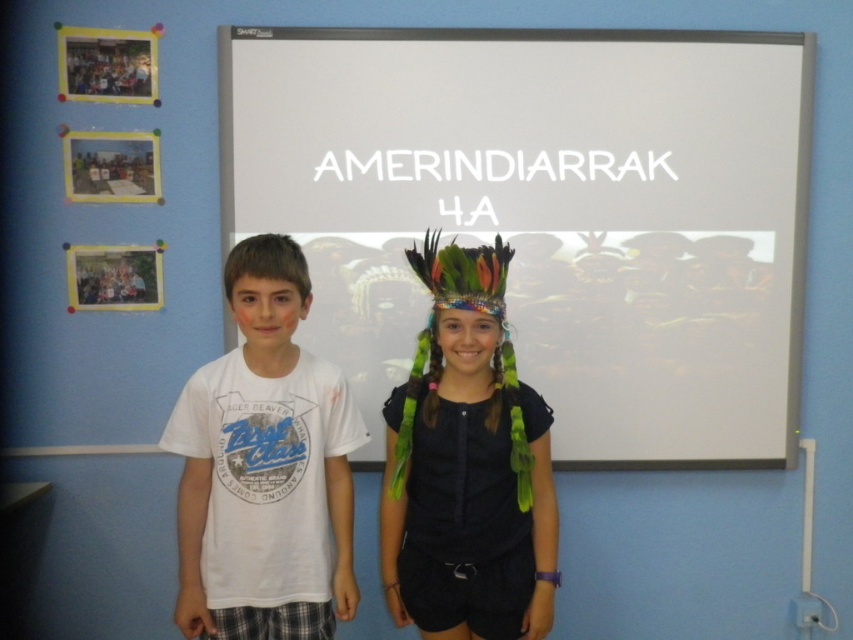
Looking at this image, between white matte projector screen at upper center and matte black photo frame at upper left, which one appears on the left side from the viewer's perspective?

From the viewer's perspective, matte black photo frame at upper left appears more on the left side.

Can you confirm if white matte projector screen at upper center is positioned to the left of matte black photo frame at upper left?

Incorrect, white matte projector screen at upper center is not on the left side of matte black photo frame at upper left.

Consider the image. Who is more distant from viewer, [553,296] or [144,88]?

The point [553,296] is more distant.

Find the location of `white matte projector screen at upper center`. white matte projector screen at upper center is located at coordinates (548, 214).

Does dark blue fabric headdress at center appear on the left side of matte black photo frame at upper left?

Incorrect, dark blue fabric headdress at center is not on the left side of matte black photo frame at upper left.

Is dark blue fabric headdress at center wider than matte black photo frame at upper left?

Indeed, dark blue fabric headdress at center has a greater width compared to matte black photo frame at upper left.

Where is `dark blue fabric headdress at center`? dark blue fabric headdress at center is located at coordinates (467, 465).

Who is taller, white matte projector screen at upper center or white matte t-shirt at center?

With more height is white matte projector screen at upper center.

Who is lower down, white matte projector screen at upper center or white matte t-shirt at center?

white matte t-shirt at center is below.

Does point (494, 76) lie in front of point (268, 458)?

No, it is not.

This screenshot has width=853, height=640. I want to click on white matte projector screen at upper center, so click(548, 214).